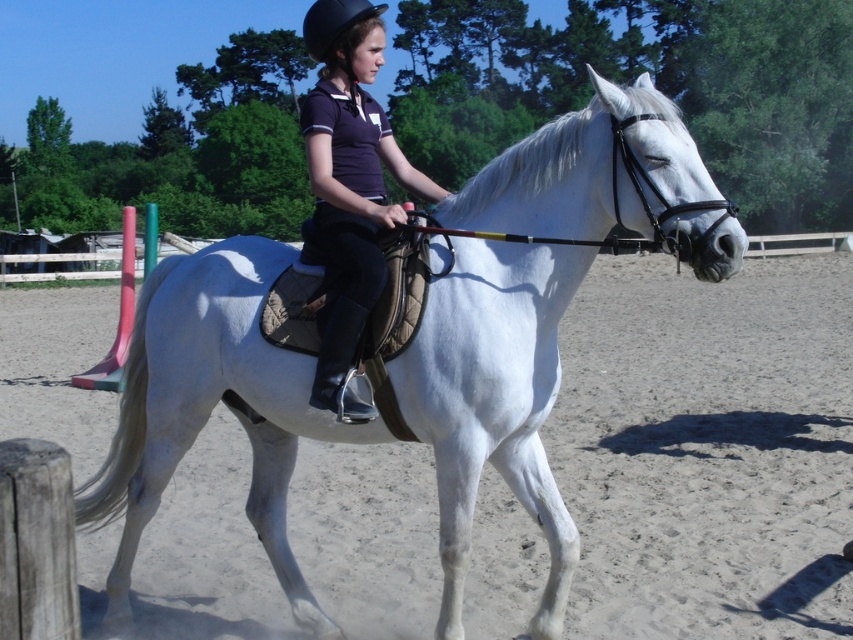
Question: Is white matte/suede saddle at center above matte black helmet at upper center?

Choices:
 (A) yes
 (B) no

Answer: (B)

Question: Which object is the closest to the black matte helmet at upper center?

Choices:
 (A) white matte/suede saddle at center
 (B) matte black helmet at upper center

Answer: (B)

Question: Among these objects, which one is nearest to the camera?

Choices:
 (A) matte black helmet at upper center
 (B) black matte helmet at upper center
 (C) white matte/suede saddle at center

Answer: (C)

Question: Can you confirm if matte black helmet at upper center is thinner than black matte helmet at upper center?

Choices:
 (A) no
 (B) yes

Answer: (B)

Question: Which point is closer to the camera taking this photo?

Choices:
 (A) (317, 8)
 (B) (569, 120)
 (C) (320, 35)

Answer: (B)

Question: Can you confirm if white matte/suede saddle at center is positioned above matte black helmet at upper center?

Choices:
 (A) yes
 (B) no

Answer: (B)